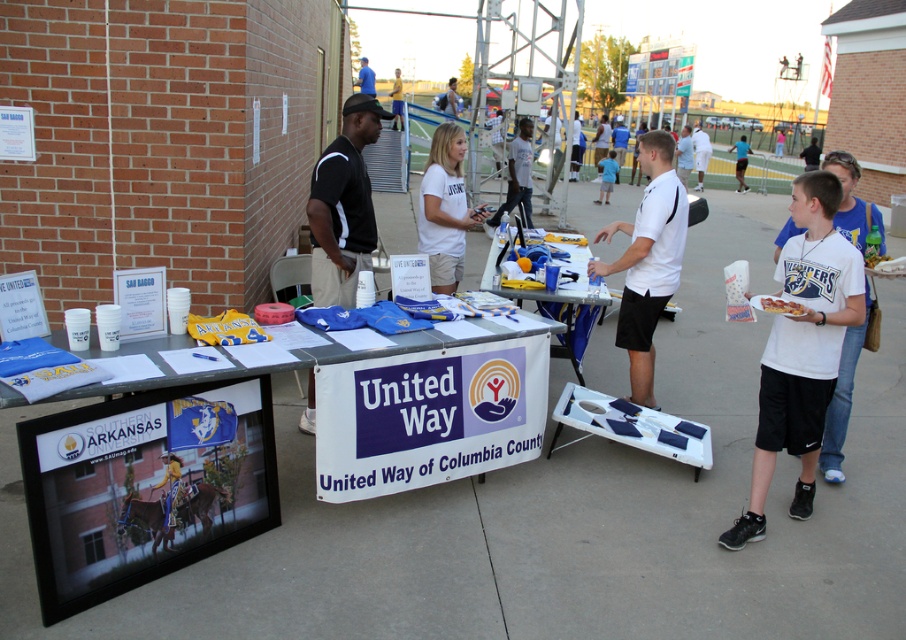
Question: Does white matte t-shirt at right appear under blue fabric shirt at upper center?

Choices:
 (A) no
 (B) yes

Answer: (B)

Question: Does white cotton shirt at center have a smaller size compared to blue fabric shirt at upper center?

Choices:
 (A) no
 (B) yes

Answer: (A)

Question: Is white paper at center positioned at the back of white matte t-shirt at right?

Choices:
 (A) no
 (B) yes

Answer: (A)

Question: Which is farther from the blue athletic uniform at center?

Choices:
 (A) white matte t-shirt at right
 (B) white paper cupcake at lower right
 (C) light blue t-shirt at center

Answer: (A)

Question: Which object is positioned farthest from the yellow shirt at center?

Choices:
 (A) white cotton shirt at center
 (B) white paper cupcake at lower right
 (C) white paper at center

Answer: (B)

Question: Among these points, which one is nearest to the camera?

Choices:
 (A) (88, 403)
 (B) (611, 152)
 (C) (456, 180)

Answer: (A)